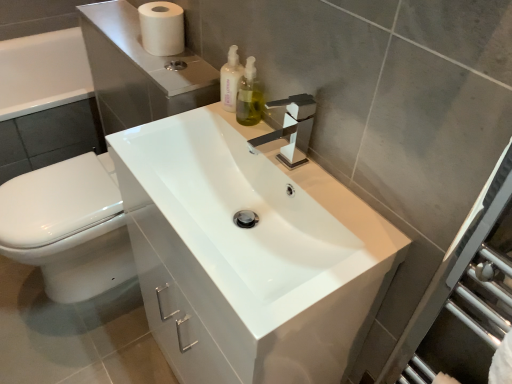
Find the location of `free location in front of white glossy toilet at lower left`. free location in front of white glossy toilet at lower left is located at coordinates (70, 343).